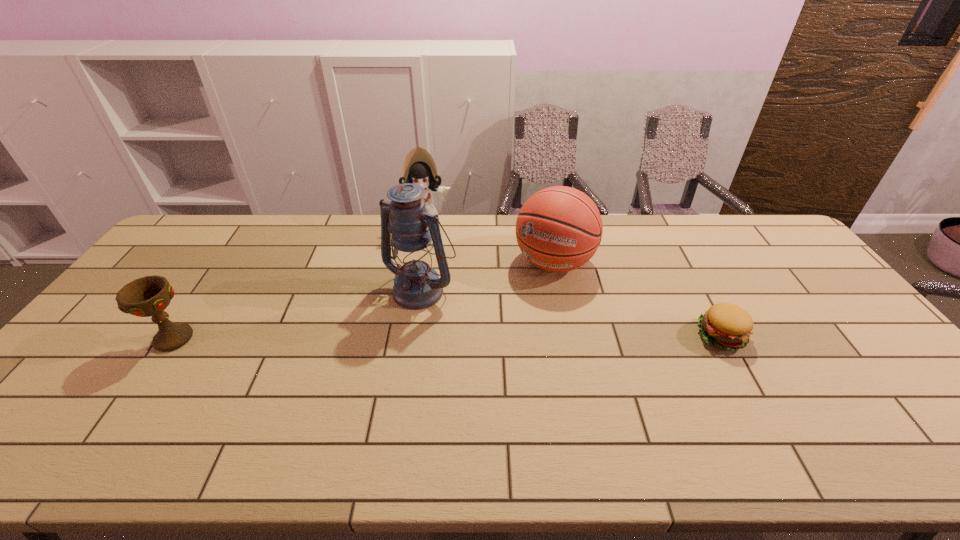
Where is `free spot between the basketball and the lantern`? Image resolution: width=960 pixels, height=540 pixels. free spot between the basketball and the lantern is located at coordinates coord(488,275).

Image resolution: width=960 pixels, height=540 pixels. Find the location of `vacant space in between the shortest object and the basketball`. vacant space in between the shortest object and the basketball is located at coordinates (637, 300).

This screenshot has height=540, width=960. I want to click on free spot between the rightmost object and the basketball, so click(x=637, y=300).

I want to click on vacant space that is in between the doll and the basketball, so click(x=490, y=244).

The width and height of the screenshot is (960, 540). I want to click on the closest object to the leftmost object, so click(x=417, y=286).

The width and height of the screenshot is (960, 540). I want to click on object that stands as the third closest to the tallest object, so click(148, 296).

Where is `free location that satisfies the following two spatial constraints: 1. on the back side of the second shortest object; 2. on the left side of the shortest object`? Image resolution: width=960 pixels, height=540 pixels. free location that satisfies the following two spatial constraints: 1. on the back side of the second shortest object; 2. on the left side of the shortest object is located at coordinates tap(175, 336).

This screenshot has height=540, width=960. Identify the location of free spot that satisfies the following two spatial constraints: 1. on the front side of the rightmost object; 2. on the right side of the doll. (408, 336).

Identify the location of vacant space that satisfies the following two spatial constraints: 1. on the back side of the chalice; 2. on the right side of the fourth object from left to right. (226, 262).